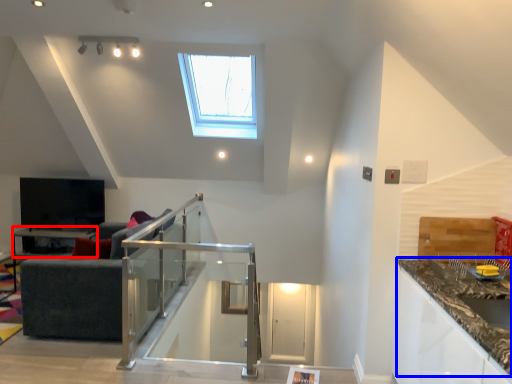
Question: Which object is closer to the camera taking this photo, table (highlighted by a red box) or countertop (highlighted by a blue box)?

Choices:
 (A) table
 (B) countertop

Answer: (B)